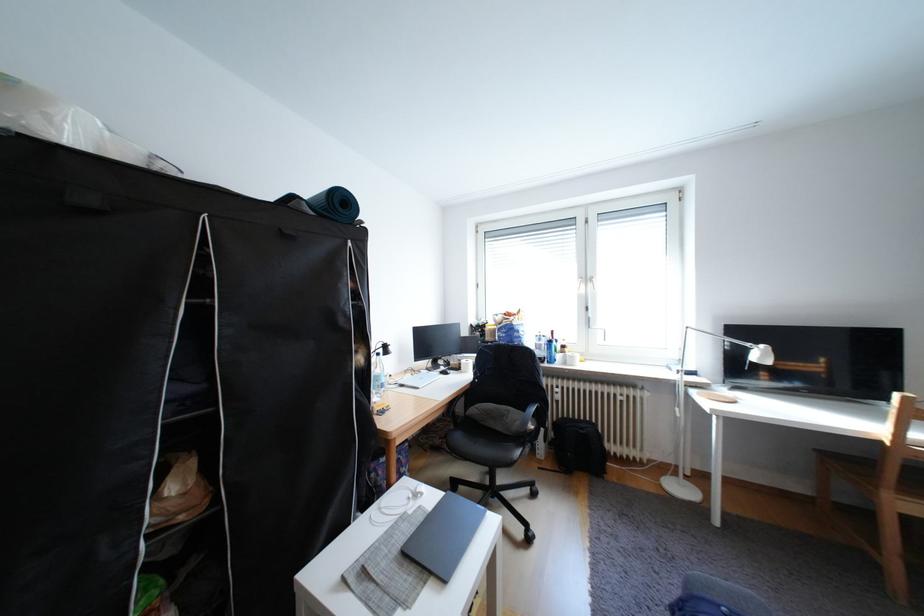
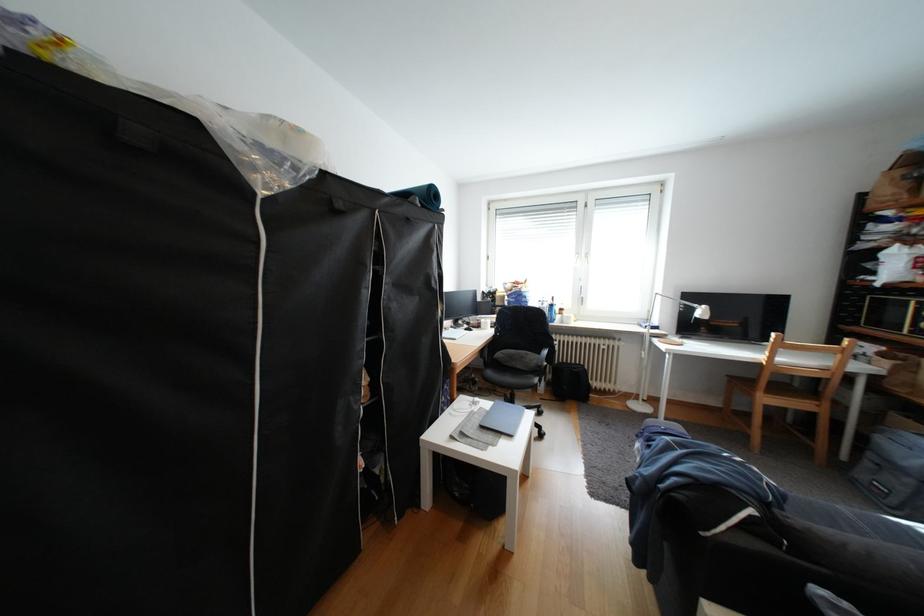
Locate, in the second image, the point that corresponds to pixel 707 392 in the first image.

(667, 341)